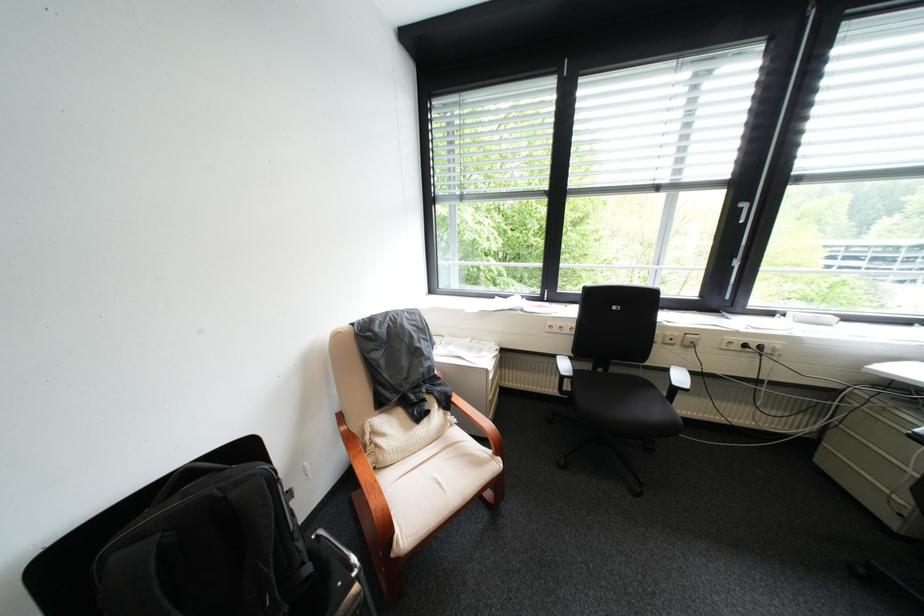
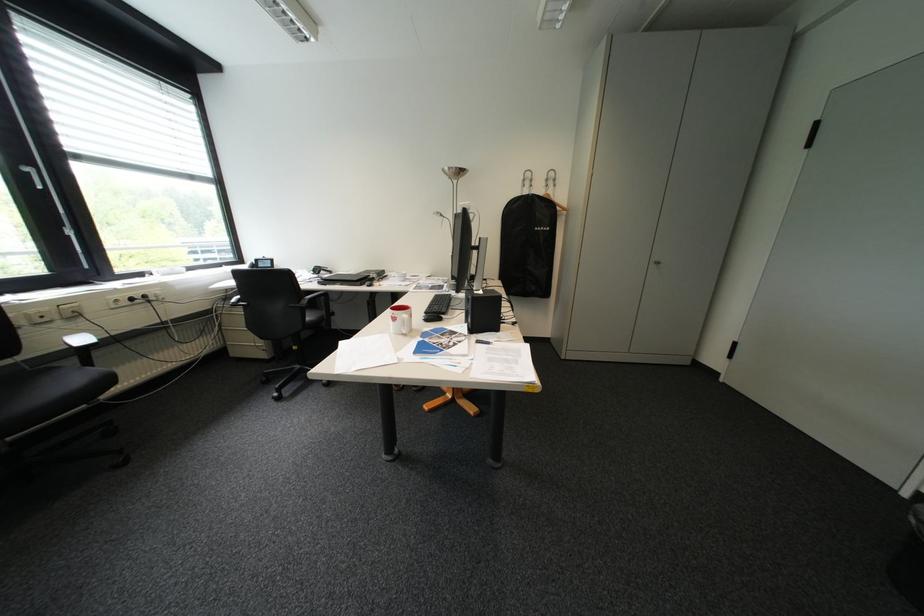
Locate, in the second image, the point that corresponds to point 665,346 in the first image.

(32, 331)